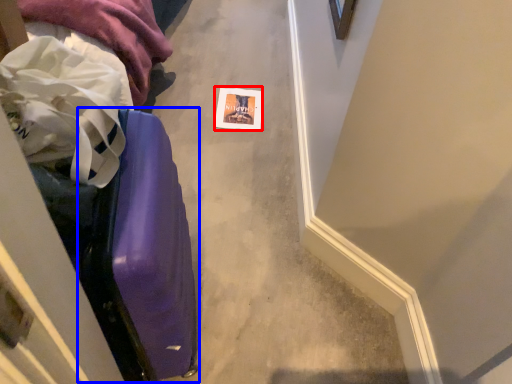
Question: Which of the following is the closest to the observer, postcard (highlighted by a red box) or luggage (highlighted by a blue box)?

Choices:
 (A) postcard
 (B) luggage

Answer: (B)